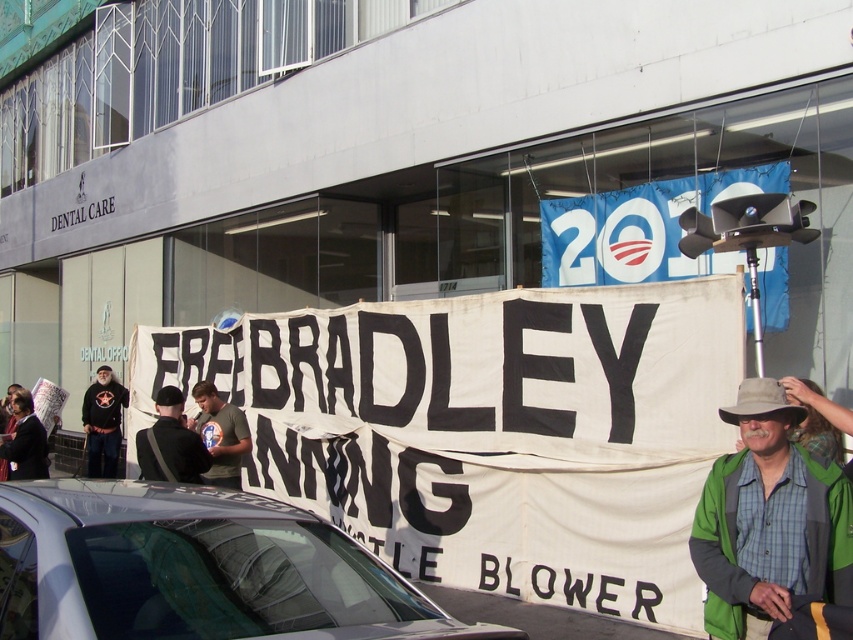
Is silver metallic car at lower center above green t-shirt at center?

Yes.

In the scene shown: Measure the distance between silver metallic car at lower center and camera.

The distance of silver metallic car at lower center from camera is 2.81 meters.

Between point (322, 588) and point (247, 440), which one is positioned behind?

Positioned behind is point (247, 440).

Locate an element on the screen. The image size is (853, 640). silver metallic car at lower center is located at coordinates (196, 570).

Does green fabric jacket at lower right have a greater width compared to green t-shirt at center?

In fact, green fabric jacket at lower right might be narrower than green t-shirt at center.

Is green fabric jacket at lower right to the right of green t-shirt at center from the viewer's perspective?

Indeed, green fabric jacket at lower right is positioned on the right side of green t-shirt at center.

Is point (849, 490) closer to camera compared to point (225, 474)?

Yes, it is in front of point (225, 474).

Find the location of a particular element. The width and height of the screenshot is (853, 640). green fabric jacket at lower right is located at coordinates (769, 520).

Consider the image. Which is more to the right, green fabric jacket at lower right or dark gray fabric jacket at center?

green fabric jacket at lower right is more to the right.

You are a GUI agent. You are given a task and a screenshot of the screen. Output one action in this format:
    pyautogui.click(x=<x>, y=<y>)
    Task: Click on the green fabric jacket at lower right
    Image resolution: width=853 pixels, height=640 pixels.
    Given the screenshot: What is the action you would take?
    pyautogui.click(x=769, y=520)

I want to click on green fabric jacket at lower right, so click(769, 520).